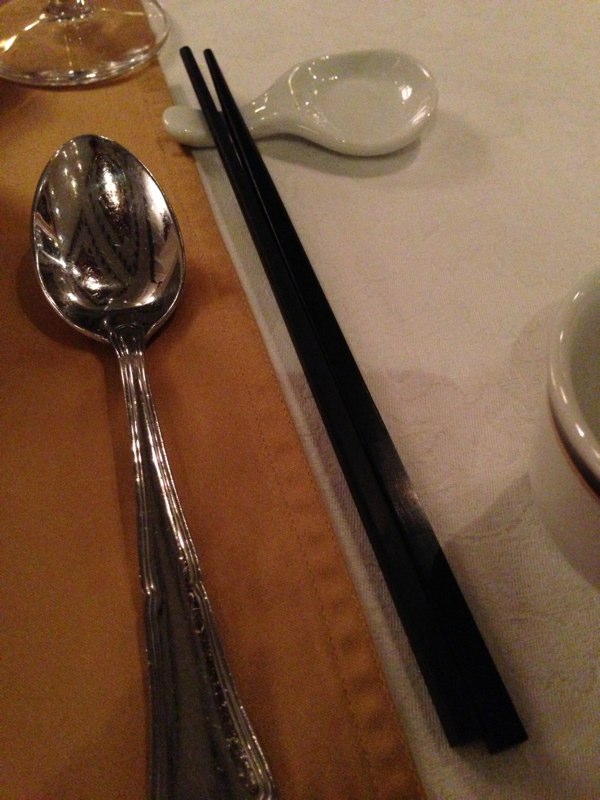
Locate an element on the screen. This screenshot has height=800, width=600. base of wineglass is located at coordinates (97, 49).